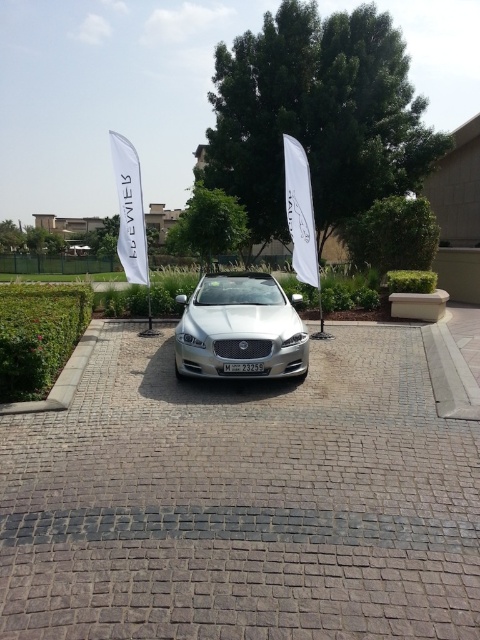
Is white fabric flag at center to the right of black plastic license plate at center from the viewer's perspective?

Indeed, white fabric flag at center is positioned on the right side of black plastic license plate at center.

What are the coordinates of `white fabric flag at center` in the screenshot? It's located at (300, 211).

Can you confirm if gray cobblestone driveway at center is positioned to the left of black plastic license plate at center?

Yes, gray cobblestone driveway at center is to the left of black plastic license plate at center.

This screenshot has height=640, width=480. Describe the element at coordinates (242, 500) in the screenshot. I see `gray cobblestone driveway at center` at that location.

Where is `gray cobblestone driveway at center`? Image resolution: width=480 pixels, height=640 pixels. gray cobblestone driveway at center is located at coordinates (242, 500).

Who is higher up, white fabric canopy at left or white fabric flag at center?

Positioned higher is white fabric canopy at left.

Does white fabric canopy at left appear over white fabric flag at center?

Yes, white fabric canopy at left is above white fabric flag at center.

Where is `white fabric canopy at left`? The width and height of the screenshot is (480, 640). white fabric canopy at left is located at coordinates (130, 211).